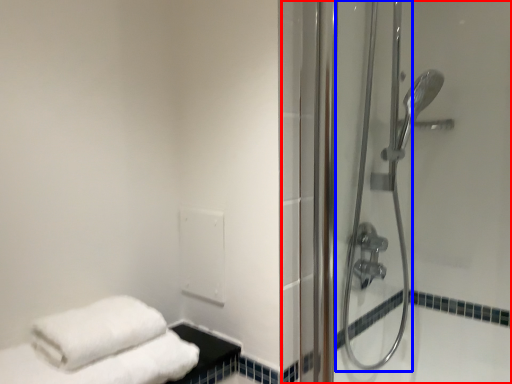
Question: Which object appears farthest to the camera in this image, shower door (highlighted by a red box) or shower door (highlighted by a blue box)?

Choices:
 (A) shower door
 (B) shower door

Answer: (B)